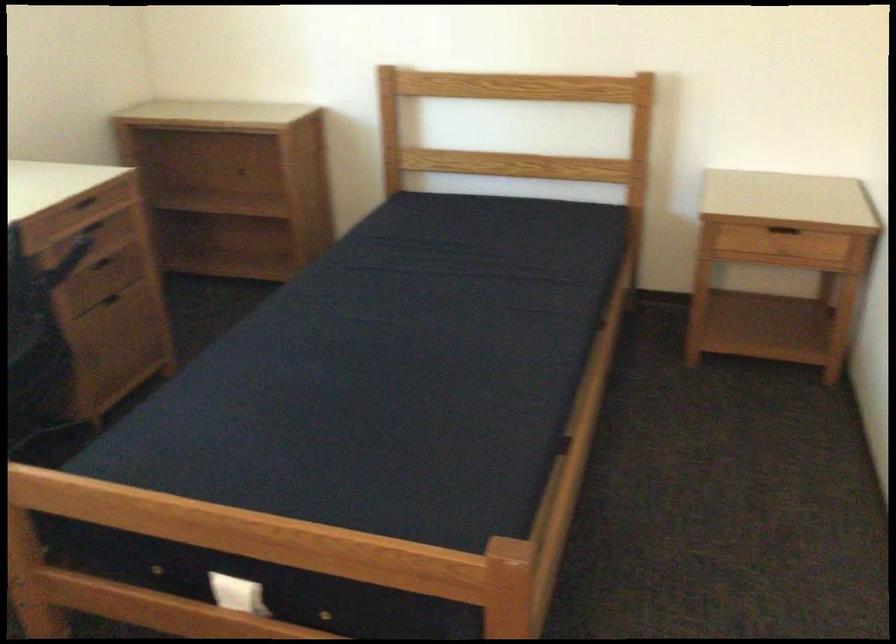
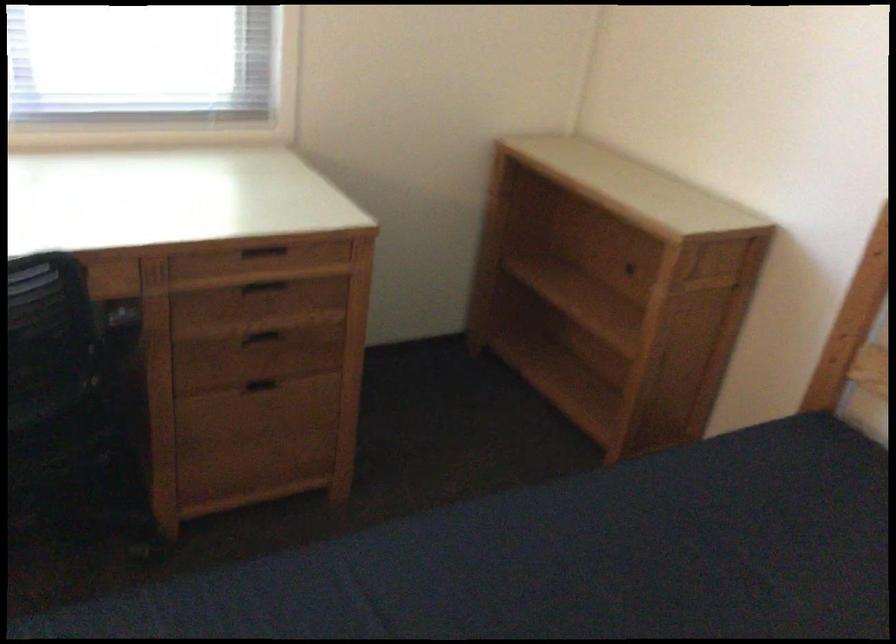
Find the pixel in the second image that matches the point at 113,299 in the first image.

(261, 384)